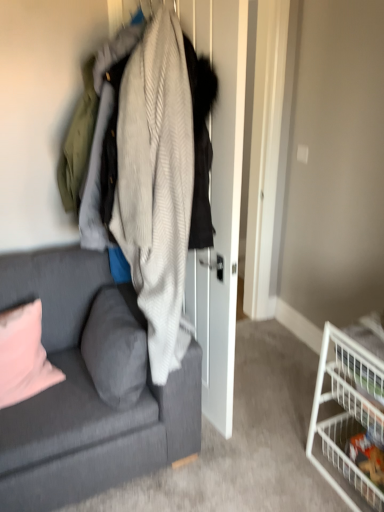
You are a GUI agent. You are given a task and a screenshot of the screen. Output one action in this format:
    pyautogui.click(x=<x>, y=<y>)
    Task: Click on the white wire basket at lower right, which is counted as the 2th shelf, starting from the top
    This screenshot has width=384, height=512.
    Given the screenshot: What is the action you would take?
    pyautogui.click(x=347, y=455)

Measure the distance between white wire basket at lower right, the first shelf in the bottom-to-top sequence, and camera.

white wire basket at lower right, the first shelf in the bottom-to-top sequence, is 1.61 meters from camera.

The image size is (384, 512). What are the coordinates of `pink fabric pillow at lower left, the second pillow from the right` in the screenshot? It's located at (24, 355).

Locate an element on the screen. Image resolution: width=384 pixels, height=512 pixels. textured gray couch at left is located at coordinates (84, 397).

How far apart are gray fabric pillow at lower left, which appears as the first pillow when viewed from the right, and knitted wool sweater at center?

They are 13.87 inches apart.

How different are the orientations of gray fabric pillow at lower left, which appears as the first pillow when viewed from the right, and knitted wool sweater at center in degrees?

There is a 8-degree angle between the facing directions of gray fabric pillow at lower left, which appears as the first pillow when viewed from the right, and knitted wool sweater at center.

Is gray fabric pillow at lower left, which appears as the first pillow when viewed from the right, far away from knitted wool sweater at center?

Actually, gray fabric pillow at lower left, which appears as the first pillow when viewed from the right, and knitted wool sweater at center are a little close together.

Is gray fabric pillow at lower left, which is the second pillow in left-to-right order, facing away from knitted wool sweater at center?

Yes, knitted wool sweater at center is at the back of gray fabric pillow at lower left, which is the second pillow in left-to-right order.

This screenshot has height=512, width=384. I want to click on closet above the white wire basket at lower right, which is counted as the 2th shelf, starting from the top (from a real-world perspective), so click(x=223, y=216).

Would you consider white wire basket at lower right, the first shelf in the bottom-to-top sequence, to be distant from knitted wool sweater at center?

No.

Is white wire basket at lower right, which is counted as the 2th shelf, starting from the top, oriented away from knitted wool sweater at center?

No.

Is white wire basket at lower right, the first shelf in the bottom-to-top sequence, to the left or to the right of knitted wool sweater at center in the image?

Clearly, white wire basket at lower right, the first shelf in the bottom-to-top sequence, is on the right of knitted wool sweater at center in the image.

Is white wire basket at lower right, which is counted as the 2th shelf, starting from the top, thinner than textured gray couch at left?

Correct, the width of white wire basket at lower right, which is counted as the 2th shelf, starting from the top, is less than that of textured gray couch at left.

How many degrees apart are the facing directions of white wire basket at lower right, which is counted as the 2th shelf, starting from the top, and textured gray couch at left?

90.7 degrees separate the facing orientations of white wire basket at lower right, which is counted as the 2th shelf, starting from the top, and textured gray couch at left.

In the scene shown: Are white wire basket at lower right, the first shelf in the bottom-to-top sequence, and textured gray couch at left beside each other?

No, white wire basket at lower right, the first shelf in the bottom-to-top sequence, is not in contact with textured gray couch at left.

Is white wire basket at lower right, the first shelf in the bottom-to-top sequence, not within textured gray couch at left?

That's correct, white wire basket at lower right, the first shelf in the bottom-to-top sequence, is outside of textured gray couch at left.

In terms of height, does knitted wool sweater at center look taller or shorter compared to gray fabric pillow at lower left, which is the second pillow in left-to-right order?

In the image, knitted wool sweater at center appears to be taller than gray fabric pillow at lower left, which is the second pillow in left-to-right order.

Locate an element on the screen. The height and width of the screenshot is (512, 384). the 1st pillow to the left when counting from the knitted wool sweater at center is located at coordinates (116, 346).

From a real-world perspective, is knitted wool sweater at center located beneath gray fabric pillow at lower left, which appears as the first pillow when viewed from the right?

No.

Is there a large distance between pink fabric pillow at lower left, the second pillow from the right, and textured gray couch at left?

No.

From a real-world perspective, is pink fabric pillow at lower left, arranged as the 1th pillow when viewed from the left, over textured gray couch at left?

Indeed, from a real-world perspective, pink fabric pillow at lower left, arranged as the 1th pillow when viewed from the left, stands above textured gray couch at left.

Can you tell me how much pink fabric pillow at lower left, arranged as the 1th pillow when viewed from the left, and textured gray couch at left differ in facing direction?

The angular difference between pink fabric pillow at lower left, arranged as the 1th pillow when viewed from the left, and textured gray couch at left is 2.79 degrees.

Would you say pink fabric pillow at lower left, arranged as the 1th pillow when viewed from the left, is to the left or to the right of textured gray couch at left in the picture?

pink fabric pillow at lower left, arranged as the 1th pillow when viewed from the left, is positioned on textured gray couch at left's left side.

From the image's perspective, would you say white wire basket at lower right, the second shelf from the bottom, is positioned over textured gray couch at left?

No, from the image's perspective, white wire basket at lower right, the second shelf from the bottom, is not over textured gray couch at left.

Which object is closer to the camera, white wire basket at lower right, the second shelf from the bottom, or textured gray couch at left?

textured gray couch at left is more forward.

Between white wire basket at lower right, the first shelf viewed from the top, and textured gray couch at left, which one has less height?

white wire basket at lower right, the first shelf viewed from the top, is shorter.

Considering the relative positions of white wire basket at lower right, the first shelf viewed from the top, and textured gray couch at left in the image provided, is white wire basket at lower right, the first shelf viewed from the top, to the left or to the right of textured gray couch at left?

Based on their positions, white wire basket at lower right, the first shelf viewed from the top, is located to the right of textured gray couch at left.

From a real-world perspective, which is physically below, textured gray couch at left or white wire basket at lower right, the second shelf from the bottom?

white wire basket at lower right, the second shelf from the bottom, is physically lower.

Does textured gray couch at left lie in front of white wire basket at lower right, the first shelf viewed from the top?

Yes, it is in front of white wire basket at lower right, the first shelf viewed from the top.

Which object is positioned more to the left, textured gray couch at left or white wire basket at lower right, the first shelf viewed from the top?

textured gray couch at left is more to the left.

Locate an element on the screen. closet above the gray fabric pillow at lower left, which appears as the first pillow when viewed from the right (from a real-world perspective) is located at coordinates (223, 216).

You are a GUI agent. You are given a task and a screenshot of the screen. Output one action in this format:
    pyautogui.click(x=<x>, y=<y>)
    Task: Click on the closet on the left of the white wire basket at lower right, which is counted as the 2th shelf, starting from the top
    The width and height of the screenshot is (384, 512).
    Given the screenshot: What is the action you would take?
    pyautogui.click(x=223, y=216)

When comparing their distances from pink fabric pillow at lower left, the second pillow from the right, does knitted wool sweater at center or white wire basket at lower right, the second shelf from the bottom, seem further?

white wire basket at lower right, the second shelf from the bottom, lies further to pink fabric pillow at lower left, the second pillow from the right, than the other object.

Estimate the real-world distances between objects in this image. Which object is further from knitted wool sweater at center, white wire basket at lower right, which is counted as the 2th shelf, starting from the top, or pink fabric pillow at lower left, arranged as the 1th pillow when viewed from the left?

The object further to knitted wool sweater at center is white wire basket at lower right, which is counted as the 2th shelf, starting from the top.

When comparing their distances from gray fabric pillow at lower left, which appears as the first pillow when viewed from the right, does knitted wool sweater at center or white wire basket at lower right, the second shelf from the bottom, seem further?

Based on the image, white wire basket at lower right, the second shelf from the bottom, appears to be further to gray fabric pillow at lower left, which appears as the first pillow when viewed from the right.

Looking at the image, which one is located further to knitted wool sweater at center, gray fabric pillow at lower left, which appears as the first pillow when viewed from the right, or white wire basket at lower right, the first shelf in the bottom-to-top sequence?

white wire basket at lower right, the first shelf in the bottom-to-top sequence.

Considering their positions, is textured gray couch at left positioned closer to white wire basket at lower right, which is counted as the 2th shelf, starting from the top, than knitted wool sweater at center?

knitted wool sweater at center lies closer to white wire basket at lower right, which is counted as the 2th shelf, starting from the top, than the other object.

When comparing their distances from textured gray couch at left, does pink fabric pillow at lower left, arranged as the 1th pillow when viewed from the left, or white wire basket at lower right, the first shelf in the bottom-to-top sequence, seem further?

white wire basket at lower right, the first shelf in the bottom-to-top sequence, is positioned further to the anchor textured gray couch at left.

Which object lies further to the anchor point pink fabric pillow at lower left, arranged as the 1th pillow when viewed from the left, white wire basket at lower right, the first shelf viewed from the top, or white wire basket at lower right, the first shelf in the bottom-to-top sequence?

white wire basket at lower right, the first shelf in the bottom-to-top sequence, is further to pink fabric pillow at lower left, arranged as the 1th pillow when viewed from the left.

When comparing their distances from pink fabric pillow at lower left, arranged as the 1th pillow when viewed from the left, does white wire basket at lower right, the first shelf viewed from the top, or knitted wool sweater at center seem closer?

Among the two, knitted wool sweater at center is located nearer to pink fabric pillow at lower left, arranged as the 1th pillow when viewed from the left.

Locate an element on the screen. This screenshot has height=512, width=384. pillow between textured gray couch at left and pink fabric pillow at lower left, arranged as the 1th pillow when viewed from the left, along the z-axis is located at coordinates (116, 346).

Identify the location of closet between pink fabric pillow at lower left, the second pillow from the right, and white wire basket at lower right, the second shelf from the bottom. (223, 216).

You are a GUI agent. You are given a task and a screenshot of the screen. Output one action in this format:
    pyautogui.click(x=<x>, y=<y>)
    Task: Click on the shelf situated between pink fabric pillow at lower left, arranged as the 1th pillow when viewed from the left, and white wire basket at lower right, the second shelf from the bottom, from left to right
    The width and height of the screenshot is (384, 512).
    Given the screenshot: What is the action you would take?
    pyautogui.click(x=347, y=455)

Where is `studio couch located between pink fabric pillow at lower left, the second pillow from the right, and white wire basket at lower right, which is counted as the 2th shelf, starting from the top, in the left-right direction`? Image resolution: width=384 pixels, height=512 pixels. studio couch located between pink fabric pillow at lower left, the second pillow from the right, and white wire basket at lower right, which is counted as the 2th shelf, starting from the top, in the left-right direction is located at coordinates (84, 397).